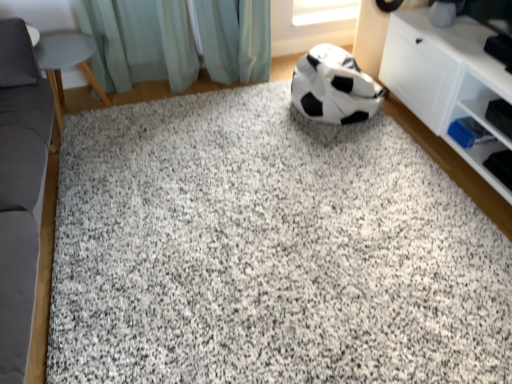
How much space does matte gray stool at left, which appears as the 1th furniture when viewed from the back, occupy vertically?

matte gray stool at left, which appears as the 1th furniture when viewed from the back, is 41.03 centimeters in height.

Consider the image. In order to face granite at center, should I rotate leftwards or rightwards?

It's best to rotate right around 1.006 degrees.

This screenshot has height=384, width=512. Describe the element at coordinates (20, 190) in the screenshot. I see `gray fabric couch at left, the first furniture viewed from the front` at that location.

Consider the image. What is the approximate width of light teal fabric at upper center?

The width of light teal fabric at upper center is 13.35 centimeters.

This screenshot has width=512, height=384. I want to click on matte gray stool at left, marked as the second furniture in a front-to-back arrangement, so click(66, 64).

In the scene shown: Measure the distance between black/white matte football at center and matte gray stool at left, which appears as the 1th furniture when viewed from the back.

black/white matte football at center and matte gray stool at left, which appears as the 1th furniture when viewed from the back, are 4.16 feet apart.

From a real-world perspective, is black/white matte football at center physically located above or below matte gray stool at left, which appears as the 1th furniture when viewed from the back?

Clearly, from a real-world perspective, black/white matte football at center is below matte gray stool at left, which appears as the 1th furniture when viewed from the back.

Can you confirm if black/white matte football at center is positioned to the left of matte gray stool at left, marked as the second furniture in a front-to-back arrangement?

No, black/white matte football at center is not to the left of matte gray stool at left, marked as the second furniture in a front-to-back arrangement.

Is black/white matte football at center next to matte gray stool at left, marked as the second furniture in a front-to-back arrangement, and touching it?

No, black/white matte football at center is not with matte gray stool at left, marked as the second furniture in a front-to-back arrangement.

Looking at their sizes, would you say white matte cabinet at right is wider or thinner than light teal fabric at upper center?

In the image, white matte cabinet at right appears to be wider than light teal fabric at upper center.

Does white matte cabinet at right come behind light teal fabric at upper center?

No, it is in front of light teal fabric at upper center.

Is white matte cabinet at right placed right next to light teal fabric at upper center?

No, white matte cabinet at right is not next to light teal fabric at upper center.

How much distance is there between white matte cabinet at right and granite at center?

A distance of 28.59 inches exists between white matte cabinet at right and granite at center.

Is white matte cabinet at right far from granite at center?

No, there isn't a large distance between white matte cabinet at right and granite at center.

Does white matte cabinet at right turn towards granite at center?

Yes, white matte cabinet at right faces towards granite at center.

In the scene shown: Can you confirm if white matte cabinet at right is bigger than granite at center?

Indeed, white matte cabinet at right has a larger size compared to granite at center.

Between point (344, 89) and point (169, 24), which one is positioned in front?

The point (344, 89) is closer.

Is black/white matte football at center completely or partially outside of light teal fabric at upper center?

black/white matte football at center is positioned outside light teal fabric at upper center.

From the image's perspective, is black/white matte football at center above light teal fabric at upper center?

No, from the image's perspective, black/white matte football at center is not on top of light teal fabric at upper center.

From a real-world perspective, is gray fabric couch at left, acting as the 2th furniture starting from the back, over granite at center?

Yes, from a real-world perspective, gray fabric couch at left, acting as the 2th furniture starting from the back, is on top of granite at center.

Is gray fabric couch at left, acting as the 2th furniture starting from the back, at the right side of granite at center?

No.

Which is in front, gray fabric couch at left, the first furniture viewed from the front, or granite at center?

gray fabric couch at left, the first furniture viewed from the front, is closer to the camera.

From the image's perspective, between light teal fabric at upper center and granite at center, who is located below?

granite at center is shown below in the image.

Considering the sizes of objects light teal fabric at upper center and granite at center in the image provided, who is thinner, light teal fabric at upper center or granite at center?

light teal fabric at upper center is thinner.

Can you confirm if light teal fabric at upper center is bigger than granite at center?

No, light teal fabric at upper center is not bigger than granite at center.

Which point is more forward, (x=14, y=220) or (x=215, y=27)?

The point (x=14, y=220) is closer to the camera.

How many degrees apart are the facing directions of gray fabric couch at left, acting as the 2th furniture starting from the back, and light teal fabric at upper center?

89.6 degrees separate the facing orientations of gray fabric couch at left, acting as the 2th furniture starting from the back, and light teal fabric at upper center.

Measure the distance between gray fabric couch at left, acting as the 2th furniture starting from the back, and light teal fabric at upper center.

gray fabric couch at left, acting as the 2th furniture starting from the back, is 36.56 inches away from light teal fabric at upper center.

Is there a large distance between gray fabric couch at left, the first furniture viewed from the front, and light teal fabric at upper center?

No, gray fabric couch at left, the first furniture viewed from the front, is not far away from light teal fabric at upper center.

The width and height of the screenshot is (512, 384). In the image, there is a matte gray stool at left, which appears as the 1th furniture when viewed from the back. Identify the location of football above it (from the image's perspective). (334, 87).

Find the location of a particular element. shelf on the right of light teal fabric at upper center is located at coordinates (447, 79).

Based on their spatial positions, is granite at center or light teal fabric at upper center further from matte gray stool at left, marked as the second furniture in a front-to-back arrangement?

Among the two, granite at center is located further to matte gray stool at left, marked as the second furniture in a front-to-back arrangement.

From the image, which object appears to be farther from granite at center, white matte cabinet at right or black/white matte football at center?

Based on the image, white matte cabinet at right appears to be further to granite at center.

Based on the photo, looking at the image, which one is located further to black/white matte football at center, light teal fabric at upper center or granite at center?

light teal fabric at upper center is positioned further to the anchor black/white matte football at center.

From the image, which object appears to be farther from light teal fabric at upper center, black/white matte football at center or white matte cabinet at right?

Among the two, white matte cabinet at right is located further to light teal fabric at upper center.

When comparing their distances from granite at center, does gray fabric couch at left, acting as the 2th furniture starting from the back, or matte gray stool at left, marked as the second furniture in a front-to-back arrangement, seem further?

matte gray stool at left, marked as the second furniture in a front-to-back arrangement, is positioned further to the anchor granite at center.

Estimate the real-world distances between objects in this image. Which object is closer to granite at center, gray fabric couch at left, the first furniture viewed from the front, or white matte cabinet at right?

white matte cabinet at right lies closer to granite at center than the other object.

Which object lies nearer to the anchor point gray fabric couch at left, acting as the 2th furniture starting from the back, black/white matte football at center or matte gray stool at left, which appears as the 1th furniture when viewed from the back?

matte gray stool at left, which appears as the 1th furniture when viewed from the back, is positioned closer to the anchor gray fabric couch at left, acting as the 2th furniture starting from the back.

Looking at the image, which one is located closer to matte gray stool at left, which appears as the 1th furniture when viewed from the back, white matte cabinet at right or gray fabric couch at left, acting as the 2th furniture starting from the back?

gray fabric couch at left, acting as the 2th furniture starting from the back, is positioned closer to the anchor matte gray stool at left, which appears as the 1th furniture when viewed from the back.

Where is `football between light teal fabric at upper center and white matte cabinet at right`? football between light teal fabric at upper center and white matte cabinet at right is located at coordinates (334, 87).

Find the location of a particular element. This screenshot has height=384, width=512. granite positioned between gray fabric couch at left, the first furniture viewed from the front, and light teal fabric at upper center from near to far is located at coordinates pyautogui.click(x=268, y=251).

Where is `granite located between gray fabric couch at left, acting as the 2th furniture starting from the back, and white matte cabinet at right in the left-right direction`? granite located between gray fabric couch at left, acting as the 2th furniture starting from the back, and white matte cabinet at right in the left-right direction is located at coordinates (268, 251).

Where is `curtain between matte gray stool at left, which appears as the 1th furniture when viewed from the back, and white matte cabinet at right`? The image size is (512, 384). curtain between matte gray stool at left, which appears as the 1th furniture when viewed from the back, and white matte cabinet at right is located at coordinates (139, 42).